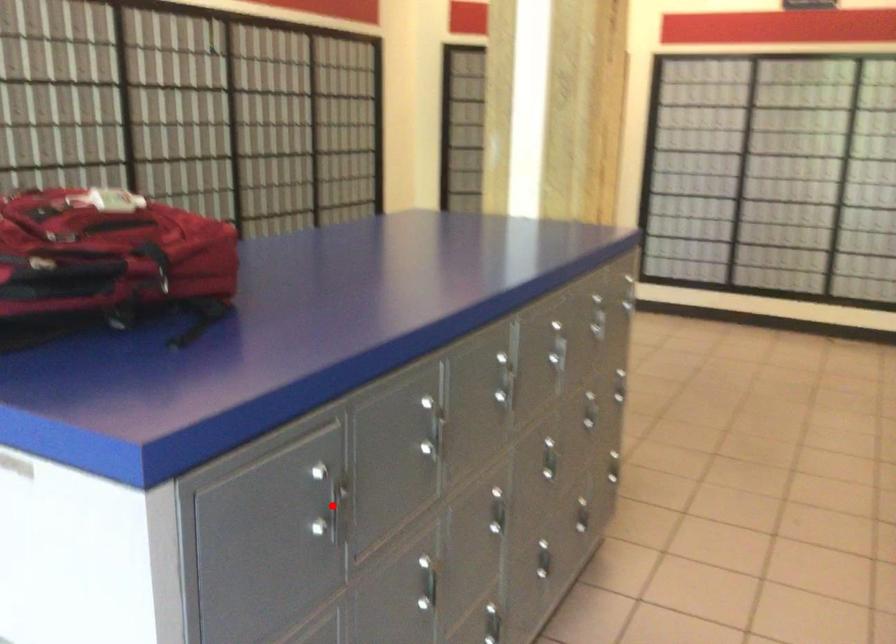
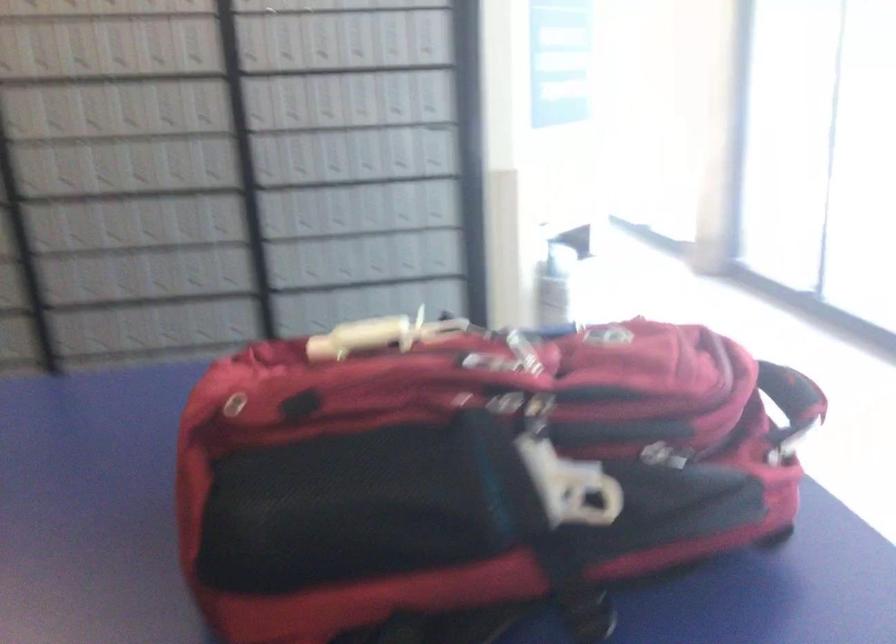
Question: I am providing you with two images of the same scene from different viewpoints. A red point is marked on the first image. Can you still see the location of the red point in image 2?

Choices:
 (A) Yes
 (B) No

Answer: (B)